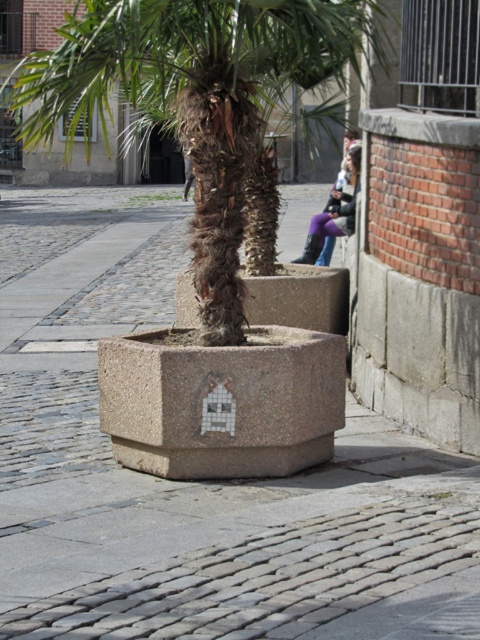
Which of these two, green leafy palm tree at center or purple denim jeans at upper center, stands taller?

green leafy palm tree at center is taller.

Can you confirm if green leafy palm tree at center is positioned to the right of purple denim jeans at upper center?

No, green leafy palm tree at center is not to the right of purple denim jeans at upper center.

Is point (250, 124) positioned behind point (304, 246)?

No, (250, 124) is in front of (304, 246).

This screenshot has width=480, height=640. What are the coordinates of `green leafy palm tree at center` in the screenshot? It's located at (195, 99).

Who is positioned more to the right, gray concrete planter at center or green leafy palm tree at center?

gray concrete planter at center

Can you confirm if gray concrete planter at center is wider than green leafy palm tree at center?

Incorrect, gray concrete planter at center's width does not surpass green leafy palm tree at center's.

Where is `gray concrete planter at center`? Image resolution: width=480 pixels, height=640 pixels. gray concrete planter at center is located at coordinates pos(193,481).

Is gray concrete planter at center to the left of purple denim jeans at upper center from the viewer's perspective?

Correct, you'll find gray concrete planter at center to the left of purple denim jeans at upper center.

Is gray concrete planter at center thinner than purple denim jeans at upper center?

No, gray concrete planter at center is not thinner than purple denim jeans at upper center.

What do you see at coordinates (193, 481) in the screenshot? The image size is (480, 640). I see `gray concrete planter at center` at bounding box center [193, 481].

Find the location of `gray concrete planter at center`. gray concrete planter at center is located at coordinates (193, 481).